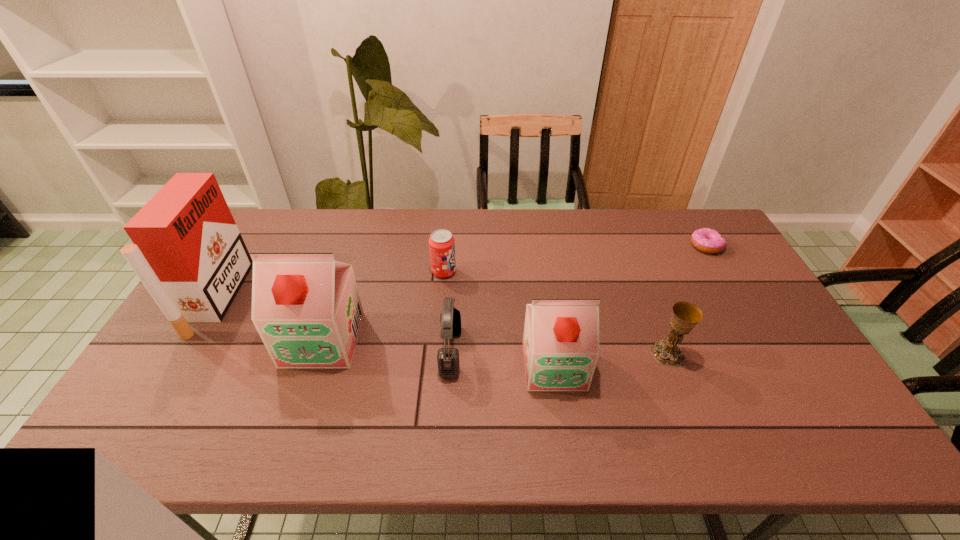
In order to click on free space in the image that satisfies the following two spatial constraints: 1. on the back side of the sixth object from left to right; 2. on the surface of the sixth tallest object in this screenshot , I will do point(636,272).